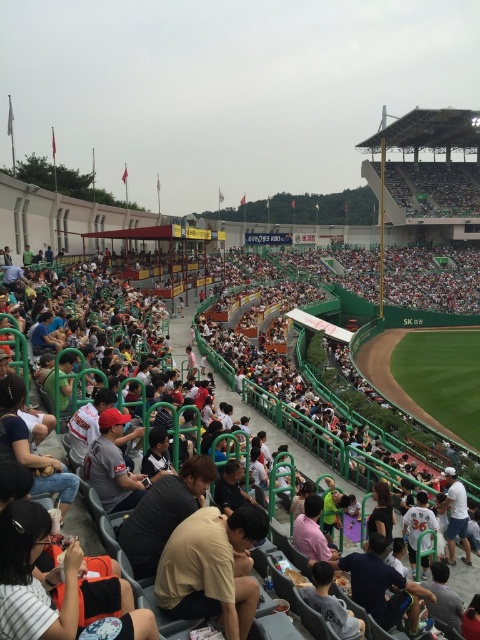
Question: Which point is closer to the camera?

Choices:
 (A) (423, 522)
 (B) (208, 577)

Answer: (B)

Question: Which point appears farthest from the camera in this image?

Choices:
 (A) (267, 403)
 (B) (203, 563)

Answer: (A)

Question: Which object is farther from the camera taking this photo?

Choices:
 (A) green plastic seats at center
 (B) light brown cotton shirt at center

Answer: (B)

Question: Does green plastic seats at center appear over light brown cotton shirt at center?

Choices:
 (A) yes
 (B) no

Answer: (A)

Question: Can you confirm if green plastic seats at center is smaller than light brown cotton shirt at center?

Choices:
 (A) yes
 (B) no

Answer: (B)

Question: Is green plastic seats at center wider than light brown cotton shirt at center?

Choices:
 (A) yes
 (B) no

Answer: (A)